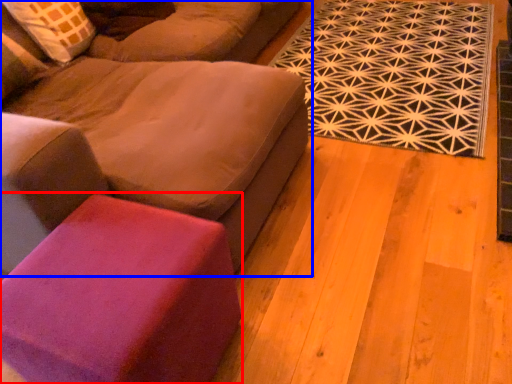
Question: Which object appears closest to the camera in this image, stool (highlighted by a red box) or studio couch (highlighted by a blue box)?

Choices:
 (A) stool
 (B) studio couch

Answer: (B)